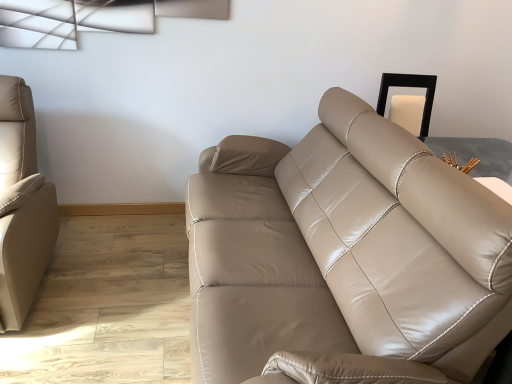
Question: Is beige leather couch at left, the 1th studio couch when ordered from left to right, wider or thinner than matte leather couch at center, which ranks as the first studio couch in right-to-left order?

Choices:
 (A) thin
 (B) wide

Answer: (A)

Question: Choose the correct answer: Is beige leather couch at left, the 1th studio couch when ordered from left to right, inside matte leather couch at center, which ranks as the 2th studio couch in left-to-right order, or outside it?

Choices:
 (A) outside
 (B) inside

Answer: (A)

Question: From the image's perspective, relative to matte leather couch at center, which ranks as the first studio couch in right-to-left order, is beige leather couch at left, the 1th studio couch when ordered from left to right, above or below?

Choices:
 (A) below
 (B) above

Answer: (B)

Question: In the image, is matte leather couch at center, which ranks as the 2th studio couch in left-to-right order, positioned in front of or behind beige leather couch at left, the 1th studio couch when ordered from left to right?

Choices:
 (A) behind
 (B) front

Answer: (B)

Question: From the image's perspective, relative to beige leather couch at left, marked as the 2th studio couch in a right-to-left arrangement, is matte leather couch at center, which ranks as the 2th studio couch in left-to-right order, above or below?

Choices:
 (A) below
 (B) above

Answer: (A)

Question: Considering the positions of matte leather couch at center, which ranks as the 2th studio couch in left-to-right order, and beige leather couch at left, marked as the 2th studio couch in a right-to-left arrangement, in the image, is matte leather couch at center, which ranks as the 2th studio couch in left-to-right order, bigger or smaller than beige leather couch at left, marked as the 2th studio couch in a right-to-left arrangement,?

Choices:
 (A) small
 (B) big

Answer: (B)

Question: From a real-world perspective, is matte leather couch at center, which ranks as the 2th studio couch in left-to-right order, above or below beige leather couch at left, marked as the 2th studio couch in a right-to-left arrangement?

Choices:
 (A) above
 (B) below

Answer: (A)